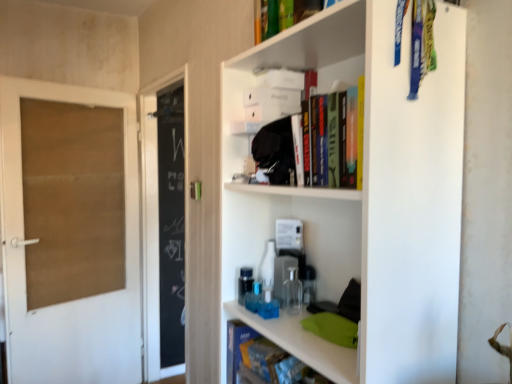
Question: Is white matte shelf at upper right taller than brown cardboard door at left?

Choices:
 (A) no
 (B) yes

Answer: (A)

Question: Considering the relative positions of white matte shelf at upper right and brown cardboard door at left in the image provided, is white matte shelf at upper right to the right of brown cardboard door at left from the viewer's perspective?

Choices:
 (A) yes
 (B) no

Answer: (A)

Question: Can you confirm if white matte shelf at upper right is shorter than brown cardboard door at left?

Choices:
 (A) no
 (B) yes

Answer: (B)

Question: Considering the relative positions of white matte shelf at upper right and brown cardboard door at left in the image provided, is white matte shelf at upper right behind brown cardboard door at left?

Choices:
 (A) yes
 (B) no

Answer: (B)

Question: Is brown cardboard door at left a part of white matte shelf at upper right?

Choices:
 (A) yes
 (B) no

Answer: (B)

Question: From a real-world perspective, is white matte shelf at upper right physically located above or below hardcover book at upper center, the 2th book in the bottom-to-top sequence?

Choices:
 (A) above
 (B) below

Answer: (B)

Question: Considering the positions of point (382, 39) and point (320, 6), is point (382, 39) closer or farther from the camera than point (320, 6)?

Choices:
 (A) closer
 (B) farther

Answer: (A)

Question: Looking at the image, does white matte shelf at upper right seem bigger or smaller compared to hardcover book at upper center, which is the 1th book from front to back?

Choices:
 (A) big
 (B) small

Answer: (A)

Question: From the image's perspective, relative to hardcover book at upper center, arranged as the first book when viewed from the top, is white matte shelf at upper right above or below?

Choices:
 (A) below
 (B) above

Answer: (A)

Question: In terms of width, does hardcover book at upper center, the 2th book in the bottom-to-top sequence, look wider or thinner when compared to brown cardboard door at left?

Choices:
 (A) wide
 (B) thin

Answer: (B)

Question: In terms of height, does hardcover book at upper center, the 2th book in the bottom-to-top sequence, look taller or shorter compared to brown cardboard door at left?

Choices:
 (A) tall
 (B) short

Answer: (B)

Question: Visually, is hardcover book at upper center, the 2th book in the bottom-to-top sequence, positioned to the left or to the right of brown cardboard door at left?

Choices:
 (A) left
 (B) right

Answer: (B)

Question: Which is correct: hardcover book at upper center, arranged as the first book when viewed from the top, is inside brown cardboard door at left, or outside of it?

Choices:
 (A) inside
 (B) outside

Answer: (B)

Question: Considering the positions of brown cardboard door at left and hardcover book at upper center, arranged as the first book when viewed from the top, in the image, is brown cardboard door at left wider or thinner than hardcover book at upper center, arranged as the first book when viewed from the top,?

Choices:
 (A) thin
 (B) wide

Answer: (B)

Question: From the image's perspective, is brown cardboard door at left positioned above or below hardcover book at upper center, the 2th book in the bottom-to-top sequence?

Choices:
 (A) above
 (B) below

Answer: (B)